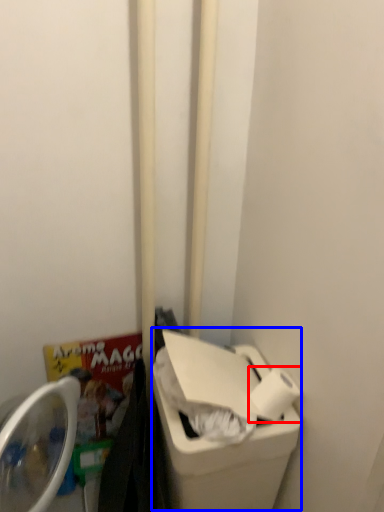
Question: Which object appears closest to the camera in this image, toilet paper (highlighted by a red box) or recycling bin (highlighted by a blue box)?

Choices:
 (A) toilet paper
 (B) recycling bin

Answer: (B)